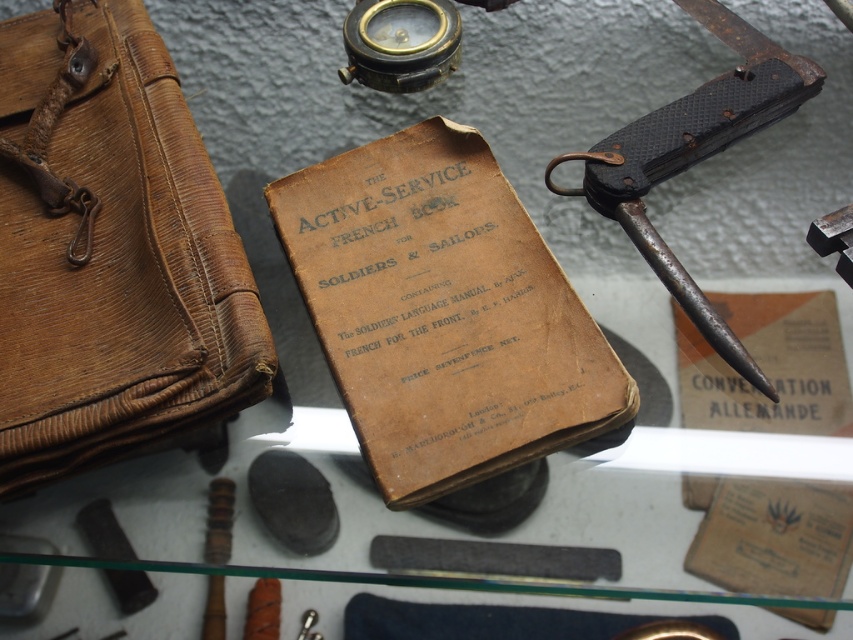
Question: Does brown leather briefcase at left appear under rusty metal knife at right?

Choices:
 (A) no
 (B) yes

Answer: (B)

Question: Considering the relative positions of brown leather briefcase at left and rusty metal knife at right in the image provided, where is brown leather briefcase at left located with respect to rusty metal knife at right?

Choices:
 (A) right
 (B) left

Answer: (B)

Question: Is brown leather briefcase at left thinner than rusty metal knife at right?

Choices:
 (A) no
 (B) yes

Answer: (A)